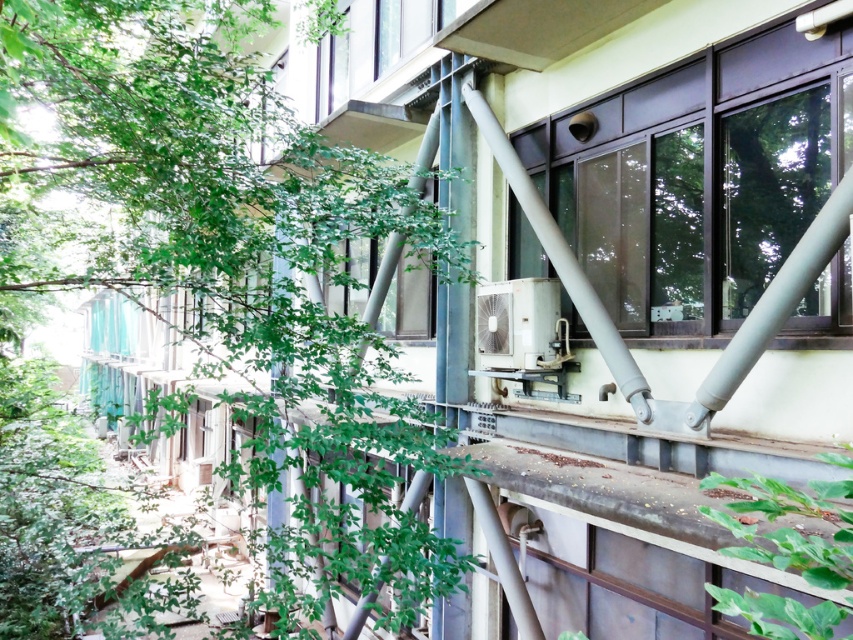
You are standing in front of the building and notice two points marked on the facade. The first point is at coordinate point (772,125) and the second point is at coordinate point (428,161). Which point appears closer to you?

Point (772,125) is closer to the viewer than point (428,161).

Based on the photo, you are standing at the base of the building and want to reach a maintenance platform located at point (x=90, y=257). The platform is 7.75 meters away from you. Can you safely walk to it without any obstacles?

The distance between you and the point (x=90, y=257) is 7.75 meters. Since there are no obstacles mentioned in the scene description, you can safely walk to the maintenance platform.

You are a window installer working on the exterior of the building. You need to replace the metallic gray window at upper right. Based on its coordinates, where exactly should you position yourself to access it?

The metallic gray window at upper right is located at point (700, 176), so you should position yourself at those coordinates to access it for replacement.